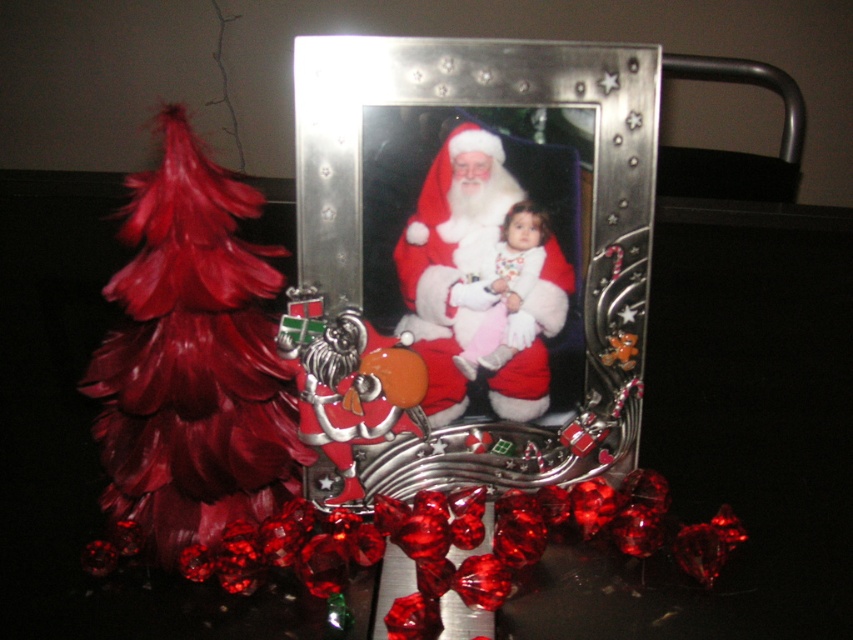
Question: Can you confirm if metallic silver picture frame at center is positioned below velvet santa at center?

Choices:
 (A) no
 (B) yes

Answer: (A)

Question: Among these points, which one is nearest to the camera?

Choices:
 (A) (503, 348)
 (B) (505, 317)
 (C) (367, 483)

Answer: (B)

Question: Estimate the real-world distances between objects in this image. Which object is closer to the velvet santa at center?

Choices:
 (A) white fluffy baby at center
 (B) metallic silver picture frame at center

Answer: (A)

Question: Which of the following is the farthest from the observer?

Choices:
 (A) (473, 88)
 (B) (397, 268)

Answer: (B)

Question: Does metallic silver picture frame at center appear on the left side of white fluffy baby at center?

Choices:
 (A) no
 (B) yes

Answer: (B)

Question: Can you confirm if velvet santa at center is positioned to the right of white fluffy baby at center?

Choices:
 (A) no
 (B) yes

Answer: (A)